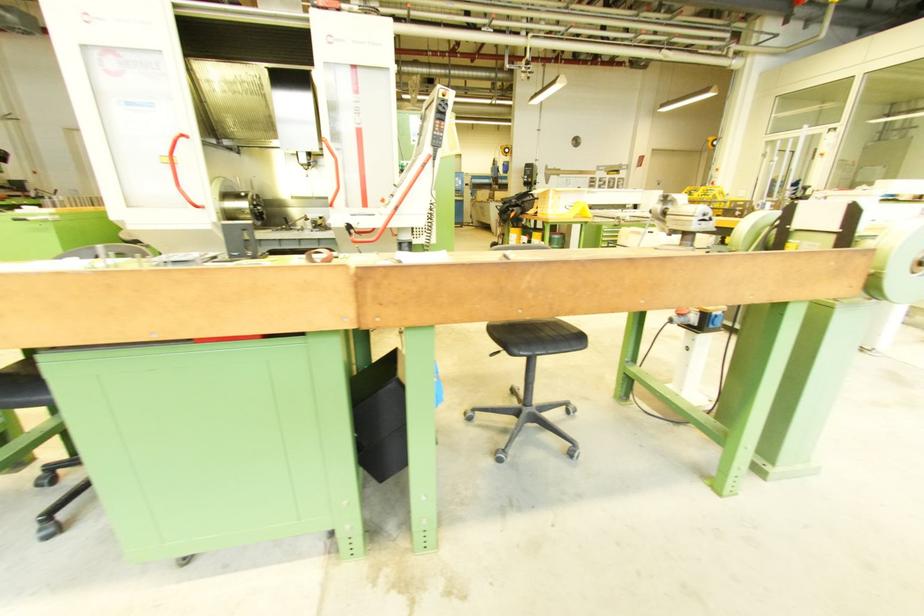
The width and height of the screenshot is (924, 616). Describe the element at coordinates (178, 169) in the screenshot. I see `a red machine handle` at that location.